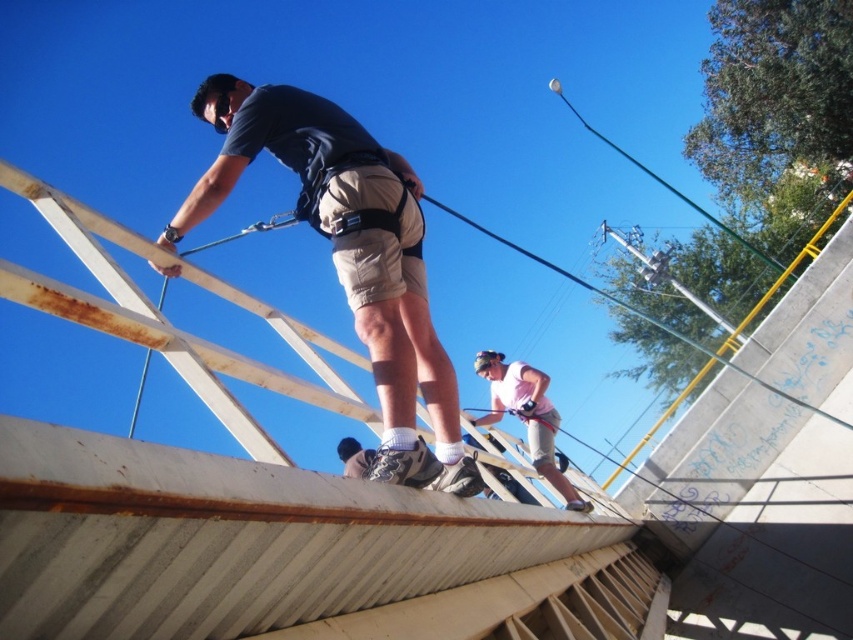
You are standing at the edge of the roof and want to hand a tool to both the matte khaki shorts at center and the pink fabric skateboarder at lower center. Which person should you hand the tool to first to ensure it reaches them without needing to move closer?

You should hand the tool first to the matte khaki shorts at center because they are closer to you than the pink fabric skateboarder at lower center, so the tool will reach them without needing to move closer.

You are a safety inspector evaluating the scene. The matte khaki shorts at center and pink fabric skateboarder at lower center are both present. Which object should you prioritize inspecting for safety concerns based on their size?

The matte khaki shorts at center should be prioritized for inspection because it is larger in size than the pink fabric skateboarder at lower center, making it potentially more hazardous if not secured properly.